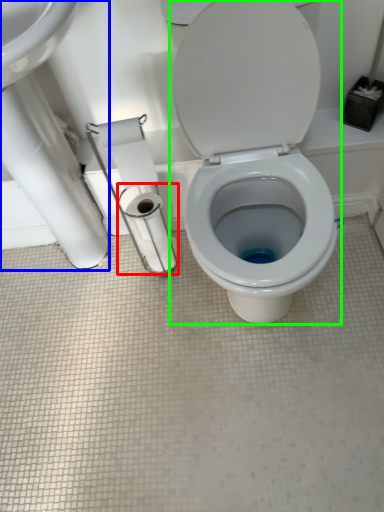
Question: Which is nearer to the toilet paper (highlighted by a red box)? sink (highlighted by a blue box) or toilet (highlighted by a green box).

Choices:
 (A) sink
 (B) toilet

Answer: (A)